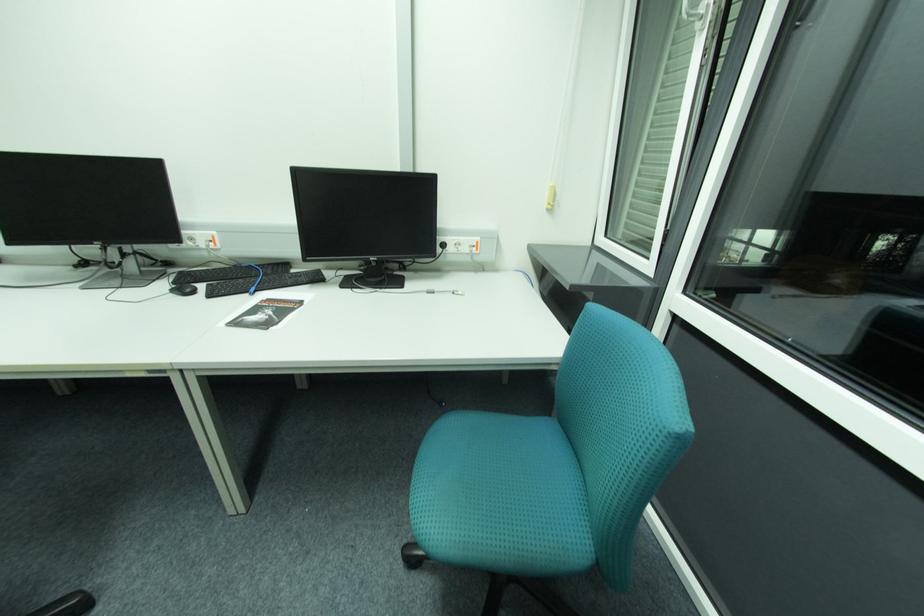
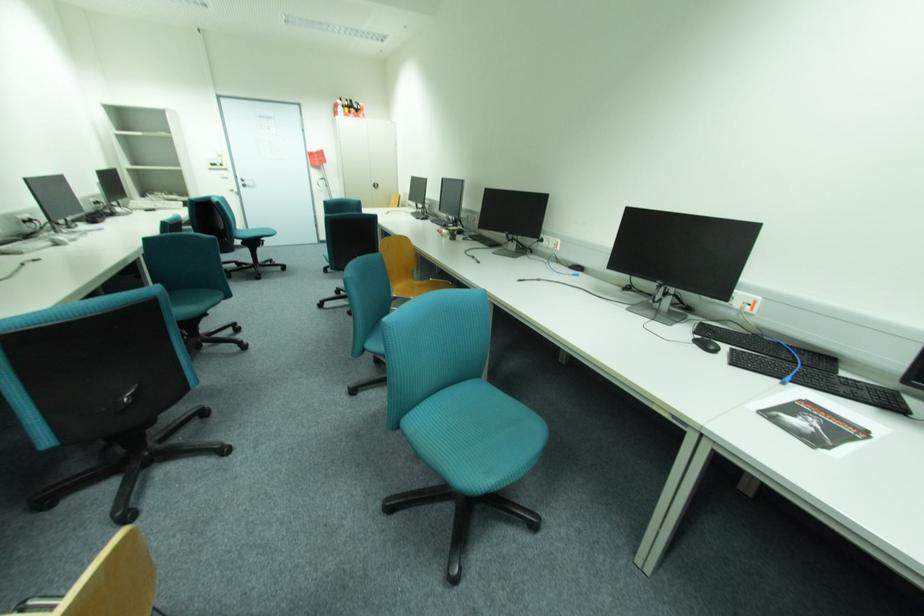
The point at (263, 265) is marked in the first image. Where is the corresponding point in the second image?

(796, 347)